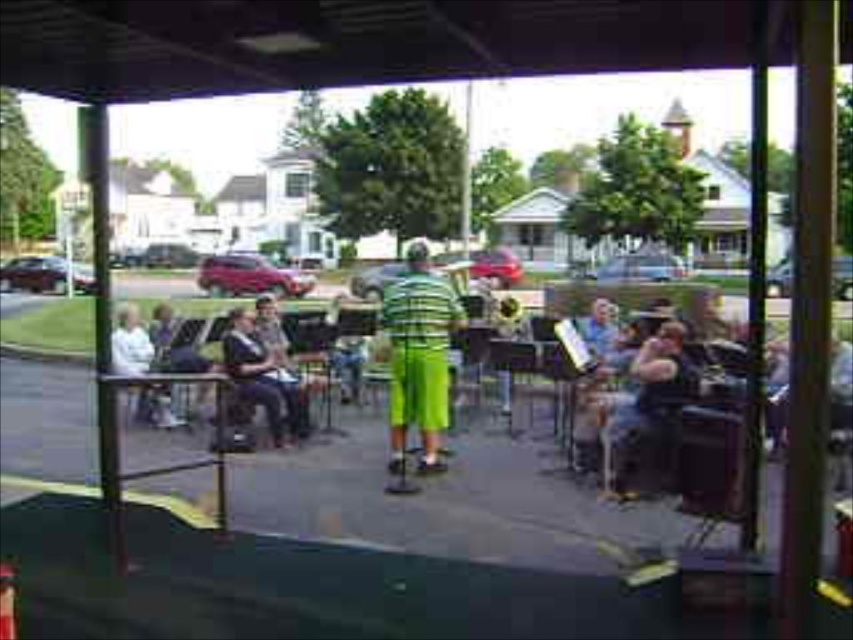
You are a photographer positioned to the side of the group. You want to capture a photo that includes both the green striped shirt at center and the dark blue fabric jacket at center. Which object should you focus on first to ensure both are in frame?

The green striped shirt at center is located above the dark blue fabric jacket at center, so you should focus on the green striped shirt at center first to ensure both are in frame.

Looking at this image, you are a photographer trying to capture a clear shot of the dark blue fabric jacket at center and the white fabric shirt at left. Based on their positions, which one is closer to the front of the scene?

The dark blue fabric jacket at center is located below the white fabric shirt at left, meaning it is positioned closer to the front of the scene.